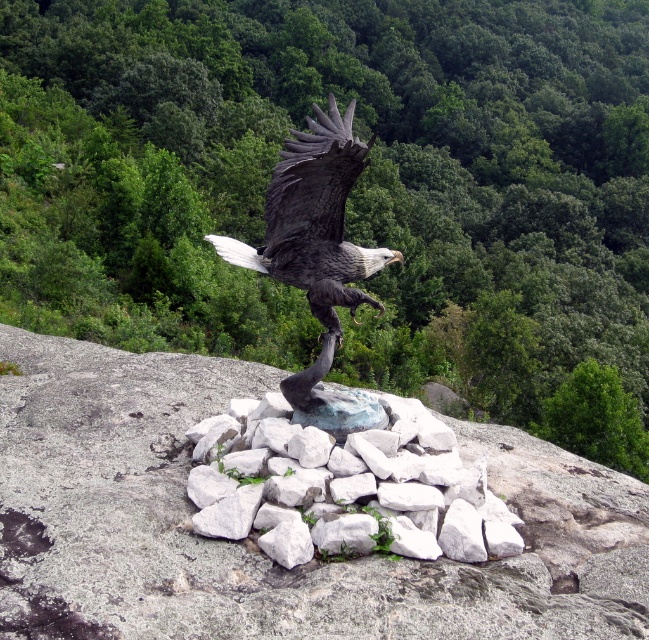
Question: Can you confirm if white stone at center is positioned to the right of shiny black eagle at center?

Choices:
 (A) no
 (B) yes

Answer: (B)

Question: Can you confirm if white stone at center is positioned to the right of shiny black eagle at center?

Choices:
 (A) yes
 (B) no

Answer: (A)

Question: Which of the following is the farthest from the observer?

Choices:
 (A) (291, 225)
 (B) (461, 532)

Answer: (A)

Question: Does white stone at center have a lesser width compared to shiny black eagle at center?

Choices:
 (A) no
 (B) yes

Answer: (B)